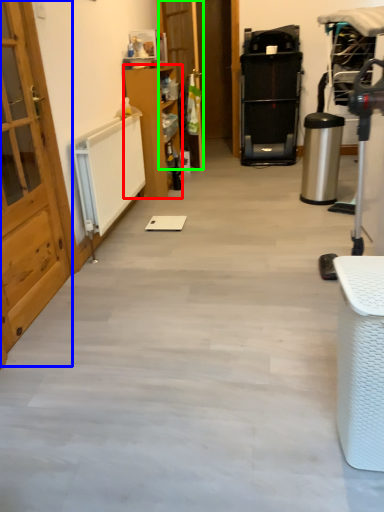
Question: Which object is the closest to the furniture (highlighted by a red box)? Choose among these: door (highlighted by a blue box) or door (highlighted by a green box).

Choices:
 (A) door
 (B) door

Answer: (B)